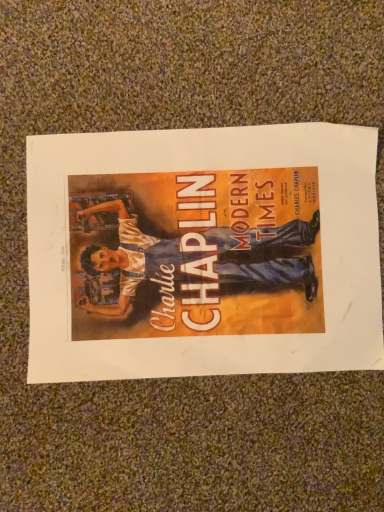
This screenshot has width=384, height=512. Describe the element at coordinates (203, 252) in the screenshot. I see `matte orange poster at center` at that location.

The width and height of the screenshot is (384, 512). What are the coordinates of `matte orange poster at center` in the screenshot? It's located at [x=203, y=252].

The image size is (384, 512). In order to click on matte orange poster at center in this screenshot , I will do `click(203, 252)`.